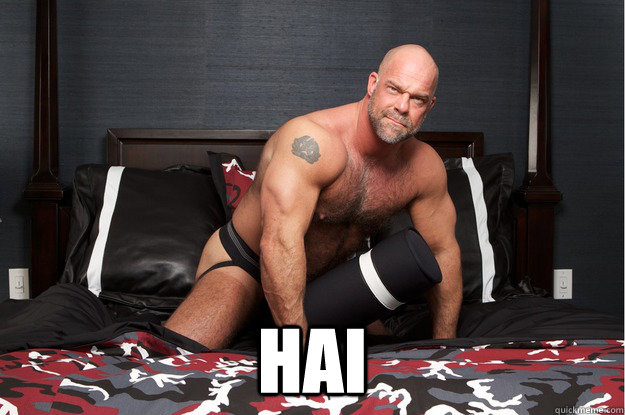
This screenshot has height=415, width=625. Identify the location of headboard. (225, 142).